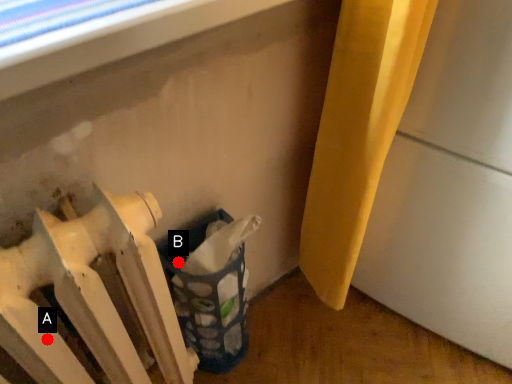
Question: Two points are circled on the image, labeled by A and B beside each circle. Which point is closer to the camera?

Choices:
 (A) A is closer
 (B) B is closer

Answer: (A)